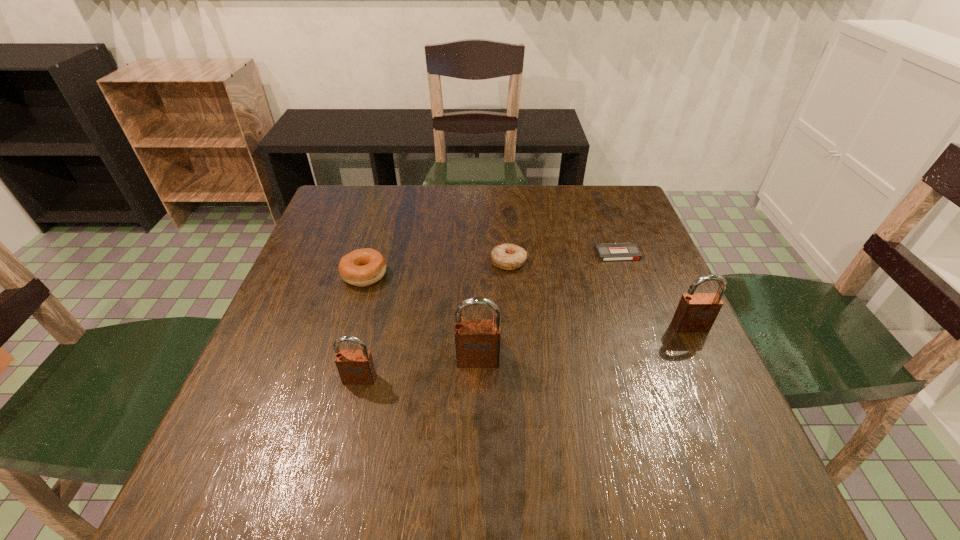
Locate an element on the screen. The height and width of the screenshot is (540, 960). blank region between the second tallest padlock and the shortest padlock is located at coordinates (525, 353).

The height and width of the screenshot is (540, 960). I want to click on vacant space that is in between the fourth tallest object and the farthest padlock, so click(527, 301).

I want to click on vacant area that lies between the fourth tallest object and the third tallest object, so click(362, 327).

Identify the location of free area in between the bagel and the shortest padlock. The height and width of the screenshot is (540, 960). (362, 327).

Find the location of `object that is the fourth closest to the bagel`. object that is the fourth closest to the bagel is located at coordinates (621, 251).

What are the coordinates of `object that can be found as the third closest to the bagel` in the screenshot? It's located at (477, 341).

Identify which padlock is the closest to the leftmost padlock. Please provide its 2D coordinates. Your answer should be formatted as a tuple, i.e. [(x, y)], where the tuple contains the x and y coordinates of a point satisfying the conditions above.

[(477, 341)]

Locate which padlock ranks in proximity to the second farthest padlock. Please provide its 2D coordinates. Your answer should be formatted as a tuple, i.e. [(x, y)], where the tuple contains the x and y coordinates of a point satisfying the conditions above.

[(355, 367)]

Locate an element on the screen. The height and width of the screenshot is (540, 960). vacant area in the image that satisfies the following two spatial constraints: 1. on the back side of the fourth tallest object; 2. on the left side of the doughnut is located at coordinates (368, 261).